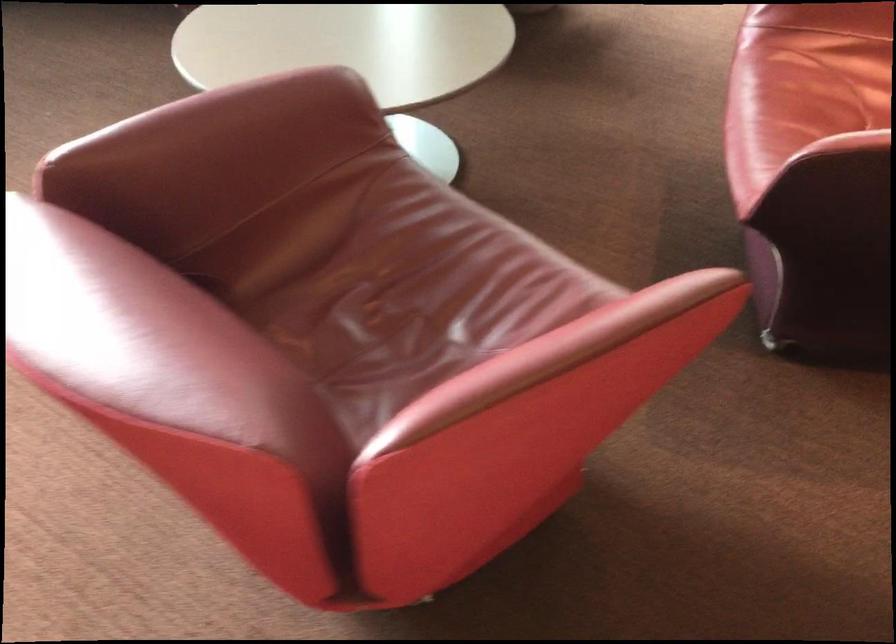
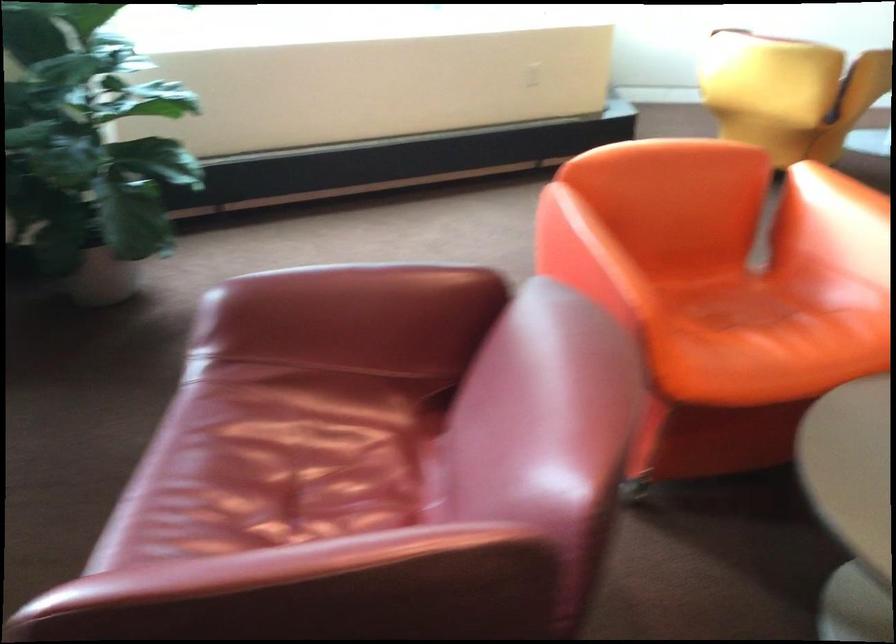
Question: The images are taken continuously from a first-person perspective. In which direction are you moving?

Choices:
 (A) Left
 (B) Right
 (C) Forward
 (D) Backward

Answer: (B)